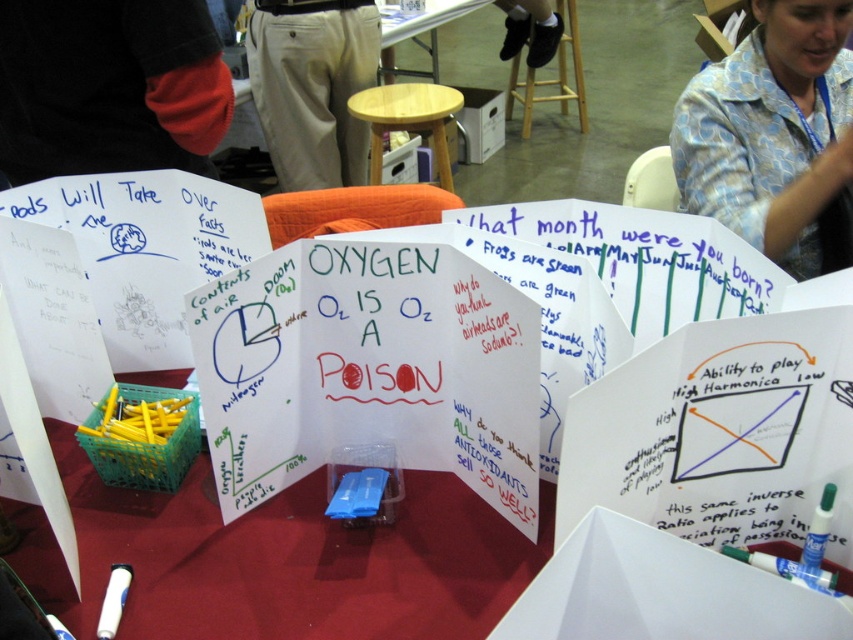
Does point (258, 588) come in front of point (821, 28)?

Yes, it is in front of point (821, 28).

Between translucent plastic table at center and blue patterned shirt at upper right, which one is positioned higher?

Positioned higher is blue patterned shirt at upper right.

Describe the element at coordinates (279, 560) in the screenshot. The width and height of the screenshot is (853, 640). I see `translucent plastic table at center` at that location.

Identify the location of translucent plastic table at center. (279, 560).

Is khaki cotton pants at center smaller than beech wood stool at center?

No, khaki cotton pants at center is not smaller than beech wood stool at center.

Who is positioned more to the left, khaki cotton pants at center or beech wood stool at center?

Positioned to the left is khaki cotton pants at center.

Which is behind, point (358, 68) or point (456, 90)?

Positioned behind is point (456, 90).

Where is `khaki cotton pants at center`? khaki cotton pants at center is located at coordinates (312, 86).

Between point (780, 216) and point (570, 4), which one is positioned in front?

Point (780, 216)

Identify the location of blue patterned shirt at upper right. The width and height of the screenshot is (853, 640). (770, 131).